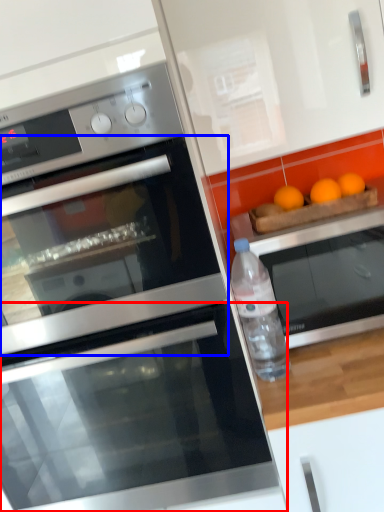
Question: Which object is further to the camera taking this photo, oven (highlighted by a red box) or oven (highlighted by a blue box)?

Choices:
 (A) oven
 (B) oven

Answer: (A)